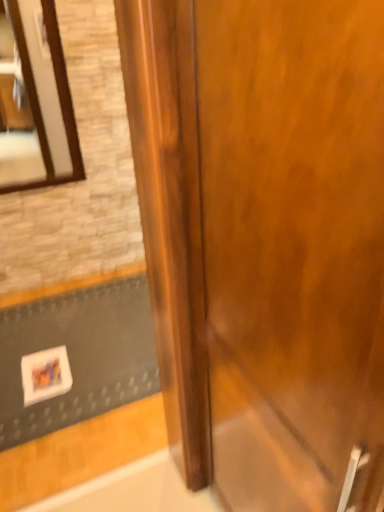
Question: In terms of width, does wooden-framed mirror at upper left look wider or thinner when compared to glossy wood door at center?

Choices:
 (A) thin
 (B) wide

Answer: (A)

Question: Would you say wooden-framed mirror at upper left is to the left or to the right of glossy wood door at center in the picture?

Choices:
 (A) left
 (B) right

Answer: (A)

Question: Considering the real-world distances, which object is farthest from the glossy wood door at center?

Choices:
 (A) white matte doormat at lower left
 (B) wooden-framed mirror at upper left

Answer: (B)

Question: Which is nearer to the wooden-framed mirror at upper left?

Choices:
 (A) glossy wood door at center
 (B) white matte doormat at lower left

Answer: (B)